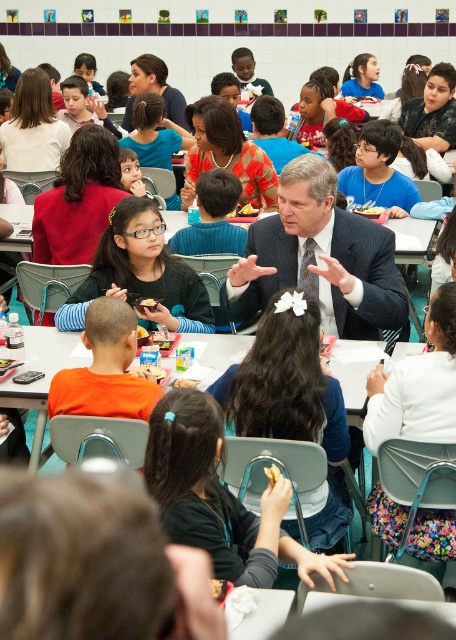
You are a student who needs to place your white matte sandwich at center into your black fabric backpack at center. Can the sandwich fit inside the backpack?

The black fabric backpack at center is wider than the white matte sandwich at center, so the sandwich should fit inside the backpack.

You are a student in the cafeteria and want to grab both the golden crispy chicken at center and the golden crispy pastry at center. Which one is on top of the other?

The golden crispy chicken at center is positioned over the golden crispy pastry at center, so the chicken is on top of the pastry.

You are standing at point [155,378] and want to walk to point [358,400]. Is the point you want to reach in front of you?

Yes, the point [358,400] is in front of point [155,378], so the destination is in front of you.